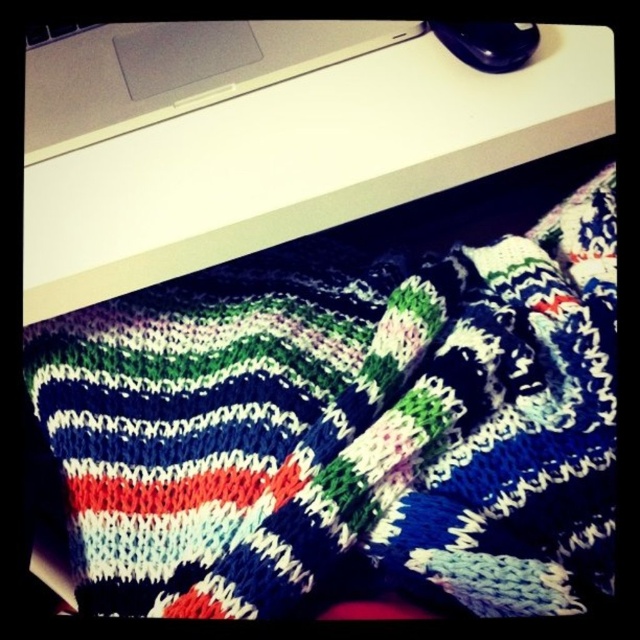
From the picture: Is white plastic computer desk at upper center below knitted woolen sock at center?

No, white plastic computer desk at upper center is not below knitted woolen sock at center.

Is white plastic computer desk at upper center positioned before knitted woolen sock at center?

No, it is behind knitted woolen sock at center.

Is point (38, 188) positioned before point (403, 465)?

No, it is behind (403, 465).

At what (x,y) coordinates should I click in order to perform the action: click on white plastic computer desk at upper center. Please return your answer as a coordinate pair (x, y). Looking at the image, I should click on (294, 154).

Does white plastic computer desk at upper center have a greater height compared to white matte laptop at upper center?

Correct, white plastic computer desk at upper center is much taller as white matte laptop at upper center.

Between white plastic computer desk at upper center and white matte laptop at upper center, which one is positioned higher?

white matte laptop at upper center

The height and width of the screenshot is (640, 640). Identify the location of white plastic computer desk at upper center. (294, 154).

Is knitted woolen sock at center behind white matte laptop at upper center?

No, it is not.

Is knitted woolen sock at center below white matte laptop at upper center?

Yes, knitted woolen sock at center is below white matte laptop at upper center.

Where is `knitted woolen sock at center`? knitted woolen sock at center is located at coordinates (365, 472).

Image resolution: width=640 pixels, height=640 pixels. I want to click on knitted woolen sock at center, so click(x=365, y=472).